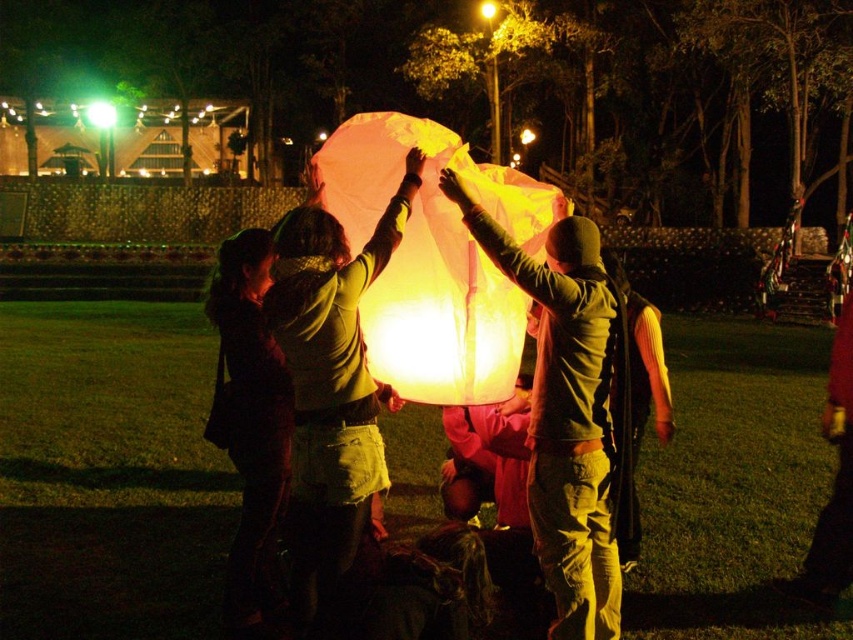
Question: Is the position of translucent paper lantern at center more distant than that of matte yellow balloon at center?

Choices:
 (A) no
 (B) yes

Answer: (B)

Question: Among these points, which one is nearest to the camera?

Choices:
 (A) (463, 179)
 (B) (572, 330)

Answer: (B)

Question: Is translucent paper lantern at center thinner than matte yellow balloon at center?

Choices:
 (A) no
 (B) yes

Answer: (A)

Question: Which point is closer to the camera?

Choices:
 (A) translucent paper lantern at center
 (B) matte yellow balloon at center

Answer: (B)

Question: Can you confirm if translucent paper lantern at center is smaller than matte yellow balloon at center?

Choices:
 (A) no
 (B) yes

Answer: (A)